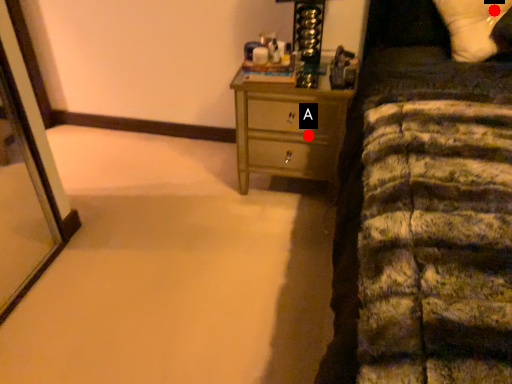
Question: Two points are circled on the image, labeled by A and B beside each circle. Which point is farther from the camera taking this photo?

Choices:
 (A) A is further
 (B) B is further

Answer: (A)